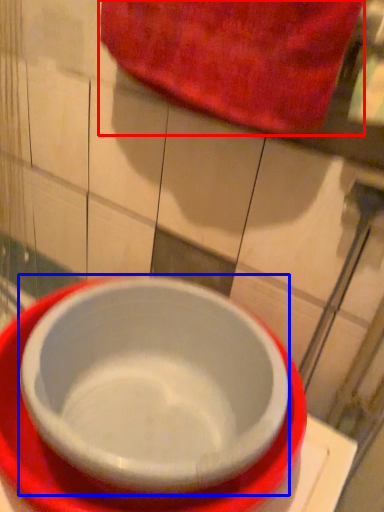
Question: Which object appears farthest to the camera in this image, beach towel (highlighted by a red box) or bowl (highlighted by a blue box)?

Choices:
 (A) beach towel
 (B) bowl

Answer: (A)